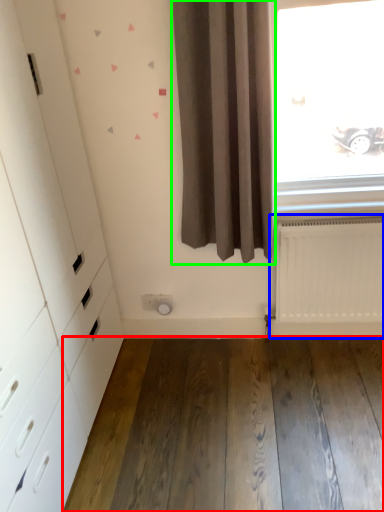
Question: Which object is positioned farthest from hardwood (highlighted by a red box)? Select from radiator (highlighted by a blue box) and curtain (highlighted by a green box).

Choices:
 (A) radiator
 (B) curtain

Answer: (B)